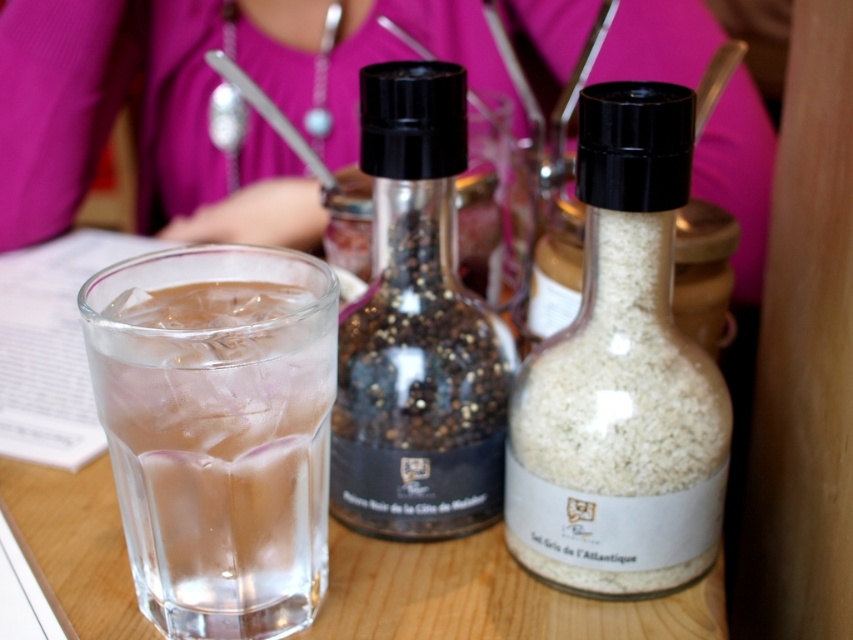
Where is `clear glass at center`? Image resolution: width=853 pixels, height=640 pixels. clear glass at center is located at coordinates (219, 461).

Which of these two, clear glass at center or black glass bottle at center, stands shorter?

Standing shorter between the two is clear glass at center.

The width and height of the screenshot is (853, 640). Find the location of `clear glass at center`. clear glass at center is located at coordinates (219, 461).

Does white matte salt shaker at center have a smaller size compared to black glass bottle at center?

Actually, white matte salt shaker at center might be larger than black glass bottle at center.

Between point (618, 573) and point (422, 444), which one is positioned behind?

The point (422, 444) is behind.

You are a GUI agent. You are given a task and a screenshot of the screen. Output one action in this format:
    pyautogui.click(x=<x>, y=<y>)
    Task: Click on the white matte salt shaker at center
    The height and width of the screenshot is (640, 853).
    Given the screenshot: What is the action you would take?
    pyautogui.click(x=621, y=376)

Is white matte salt shaker at center to the left of clear glass at center from the viewer's perspective?

Incorrect, white matte salt shaker at center is not on the left side of clear glass at center.

Who is taller, white matte salt shaker at center or clear glass at center?

white matte salt shaker at center is taller.

The image size is (853, 640). Describe the element at coordinates (621, 376) in the screenshot. I see `white matte salt shaker at center` at that location.

In order to click on white matte salt shaker at center in this screenshot , I will do `click(621, 376)`.